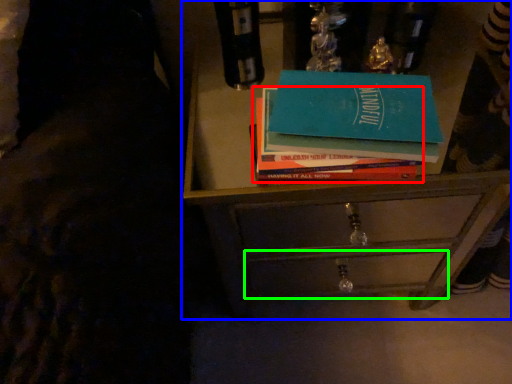
Question: Which is farther away from book (highlighted by a red box)? chest of drawers (highlighted by a blue box) or drawer (highlighted by a green box)?

Choices:
 (A) chest of drawers
 (B) drawer

Answer: (B)